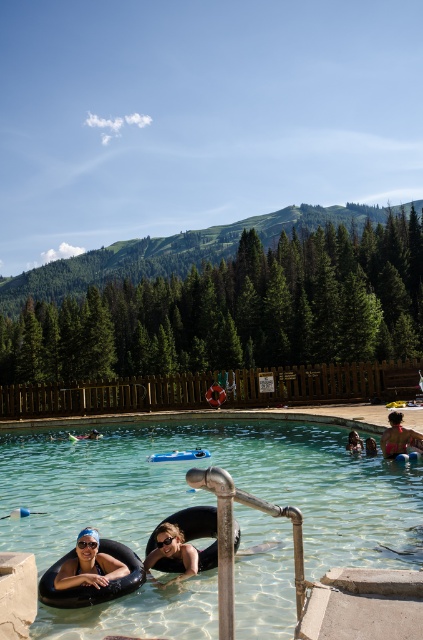
Question: Where is clear plastic pool at center located in relation to matte black swim ring at lower left in the image?

Choices:
 (A) below
 (B) above

Answer: (A)

Question: Is matte black swim ring at lower center in front of smooth black swim ring at center?

Choices:
 (A) no
 (B) yes

Answer: (B)

Question: Which point is farther to the camera?

Choices:
 (A) (161, 461)
 (B) (373, 436)
 (C) (76, 570)
 (D) (389, 456)

Answer: (A)

Question: Which point appears closest to the camera in this image?

Choices:
 (A) (365, 438)
 (B) (63, 515)
 (C) (346, 449)
 (D) (390, 412)

Answer: (B)

Question: Is matte black swim ring at lower center below smooth black swim ring at center?

Choices:
 (A) yes
 (B) no

Answer: (B)

Question: Which point is farther to the camera?

Choices:
 (A) smooth skin person at center
 (B) clear plastic pool at center
 (C) smooth black swim ring at center

Answer: (A)